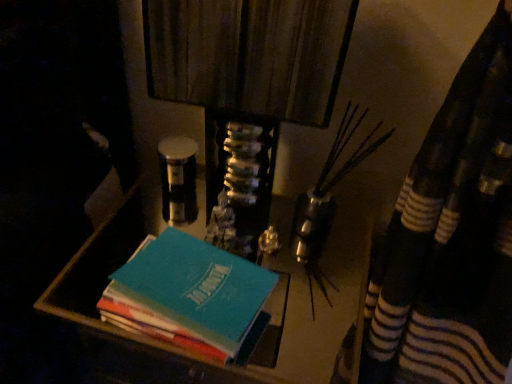
Question: Would you say teal matte book at center is to the left or to the right of teal matte book stack at center in the picture?

Choices:
 (A) left
 (B) right

Answer: (A)

Question: Is teal matte book at center wider or thinner than teal matte book stack at center?

Choices:
 (A) wide
 (B) thin

Answer: (B)

Question: Is teal matte book at center taller or shorter than teal matte book stack at center?

Choices:
 (A) tall
 (B) short

Answer: (B)

Question: From the image's perspective, relative to teal matte book at center, is teal matte book stack at center above or below?

Choices:
 (A) above
 (B) below

Answer: (B)

Question: From a real-world perspective, is teal matte book stack at center physically located above or below teal matte book at center?

Choices:
 (A) below
 (B) above

Answer: (A)

Question: Considering the positions of teal matte book stack at center and teal matte book at center in the image, is teal matte book stack at center wider or thinner than teal matte book at center?

Choices:
 (A) wide
 (B) thin

Answer: (A)

Question: Considering their positions, is teal matte book stack at center located in front of or behind teal matte book at center?

Choices:
 (A) behind
 (B) front

Answer: (A)